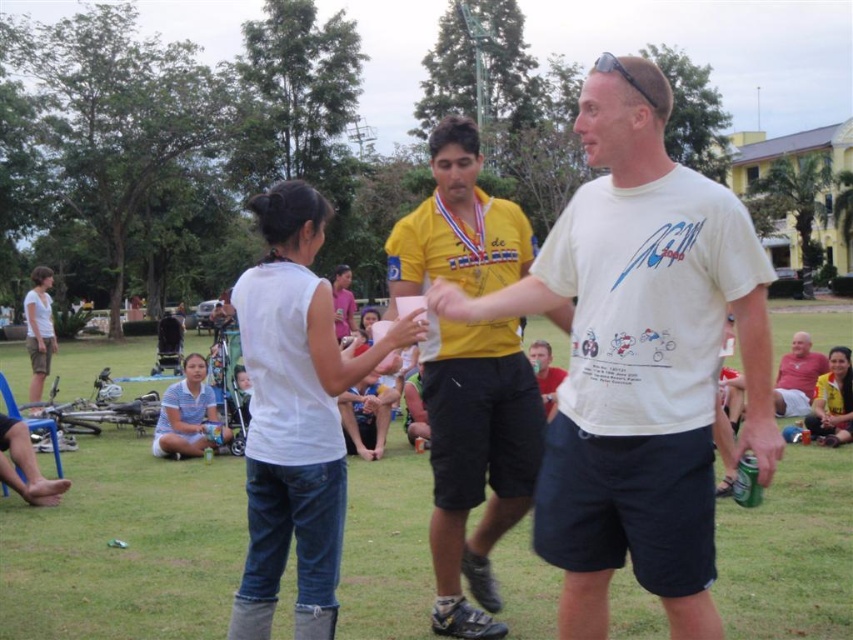
You are standing in the park and want to take a photo of the green grass at center and the white matte shirt at center. Which object should you focus on first to ensure both are in focus?

The green grass at center is in front of the white matte shirt at center, so you should focus on the green grass at center first to ensure both are in focus.

You are standing at the edge of the park and want to walk to the green grass at center. Which direction should you move in?

You should move towards the center of the park to reach the green grass at center.